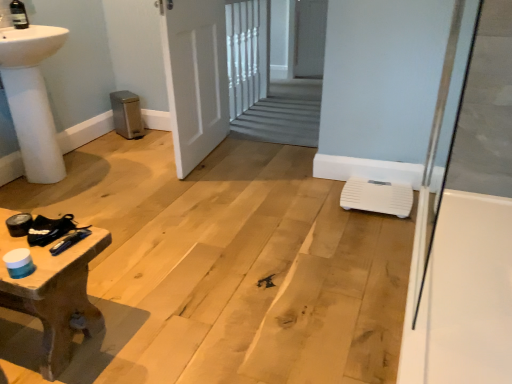
Locate an element on the screen. This screenshot has height=384, width=512. unoccupied area in front of white plastic scale at lower right is located at coordinates (375, 227).